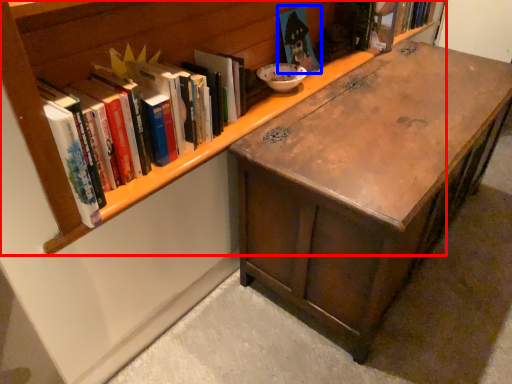
Question: Which object is further to the camera taking this photo, bookcase (highlighted by a red box) or book (highlighted by a blue box)?

Choices:
 (A) bookcase
 (B) book

Answer: (B)